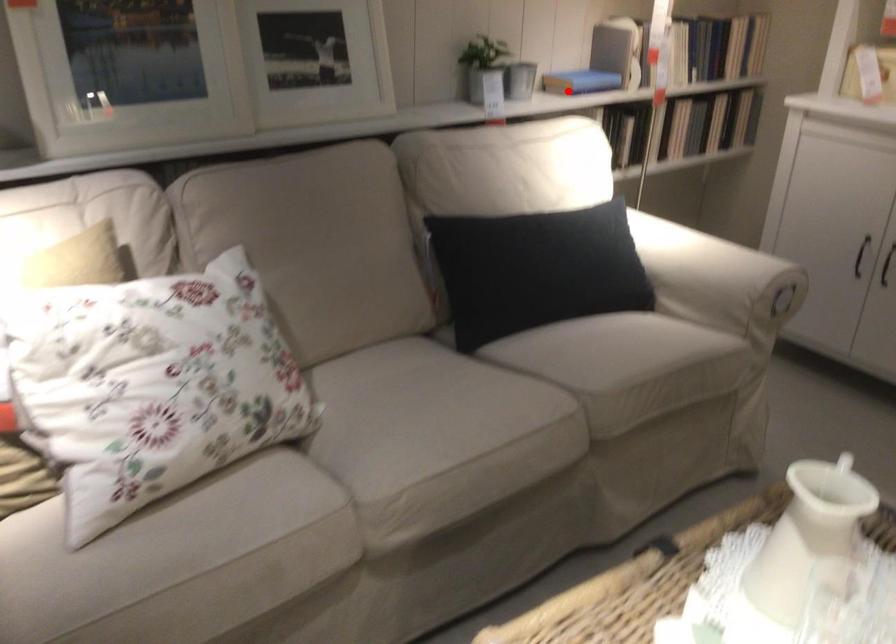
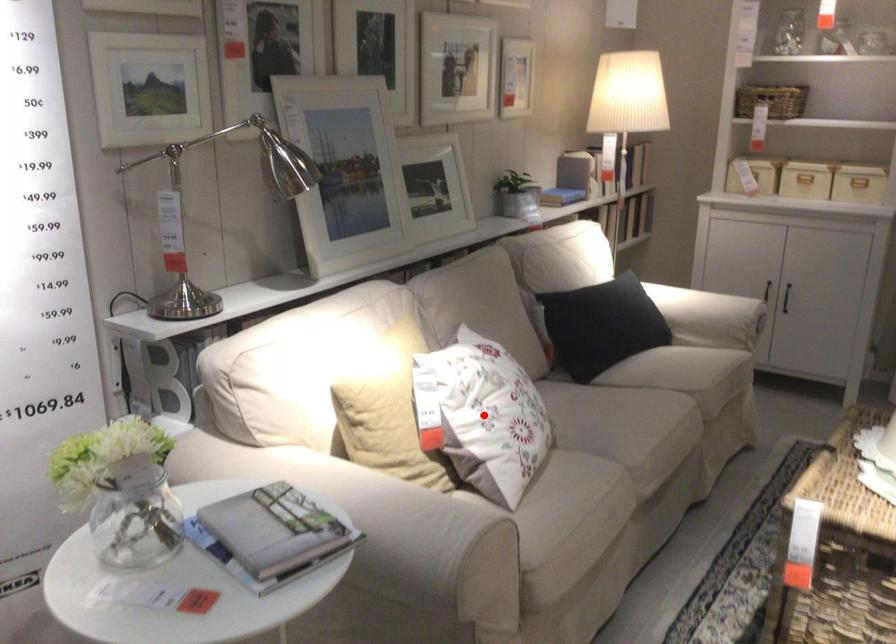
I am providing you with two images of the same scene from different viewpoints. A red point is marked on the first image and another point is marked on the second image. Do the highlighted points in image1 and image2 indicate the same real-world spot?

No